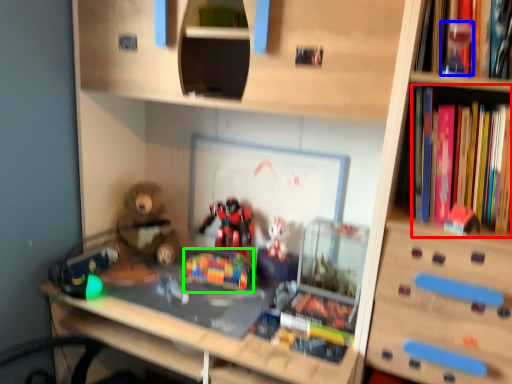
Question: Estimate the real-world distances between objects in this image. Which object is closer to book (highlighted by a red box), toy (highlighted by a blue box) or toy (highlighted by a green box)?

Choices:
 (A) toy
 (B) toy

Answer: (A)